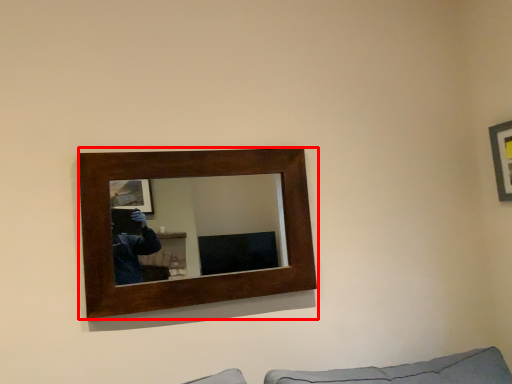
Question: From the image's perspective, what is the correct spatial relationship of picture frame (annotated by the red box) in relation to picture frame?

Choices:
 (A) above
 (B) below

Answer: (B)